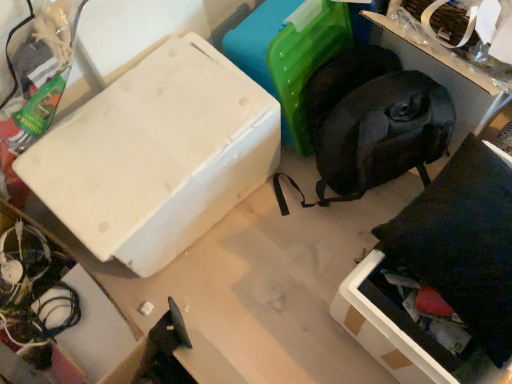
Question: Is the surface of white matte cardboard box at lower left in direct contact with black fabric bag at upper right?

Choices:
 (A) no
 (B) yes

Answer: (A)

Question: Is white matte cardboard box at lower left turned away from black fabric bag at upper right?

Choices:
 (A) yes
 (B) no

Answer: (B)

Question: Does white matte cardboard box at lower left contain black fabric bag at upper right?

Choices:
 (A) no
 (B) yes

Answer: (A)

Question: Is white matte cardboard box at lower left thinner than black fabric bag at upper right?

Choices:
 (A) no
 (B) yes

Answer: (B)

Question: Is white matte cardboard box at lower left shorter than black fabric bag at upper right?

Choices:
 (A) no
 (B) yes

Answer: (B)

Question: Does point (50, 142) appear closer or farther from the camera than point (30, 228)?

Choices:
 (A) farther
 (B) closer

Answer: (B)

Question: Looking at their shapes, would you say white matte box at upper left is wider or thinner than white matte cardboard box at lower left?

Choices:
 (A) thin
 (B) wide

Answer: (A)

Question: Is white matte box at upper left bigger or smaller than white matte cardboard box at lower left?

Choices:
 (A) big
 (B) small

Answer: (B)

Question: In the image, is white matte box at upper left positioned in front of or behind white matte cardboard box at lower left?

Choices:
 (A) front
 (B) behind

Answer: (B)

Question: Considering the relative positions of white matte cardboard box at lower left and white matte box at upper left in the image provided, is white matte cardboard box at lower left to the left or to the right of white matte box at upper left?

Choices:
 (A) right
 (B) left

Answer: (B)

Question: From a real-world perspective, is white matte cardboard box at lower left above or below white matte box at upper left?

Choices:
 (A) below
 (B) above

Answer: (B)

Question: From the image's perspective, is white matte cardboard box at lower left above or below white matte box at upper left?

Choices:
 (A) below
 (B) above

Answer: (A)

Question: Is white matte cardboard box at lower left in front of or behind white matte box at upper left in the image?

Choices:
 (A) behind
 (B) front

Answer: (B)

Question: From the image's perspective, relative to white matte box at upper left, is black fabric bag at upper right above or below?

Choices:
 (A) above
 (B) below

Answer: (A)

Question: Considering the relative positions of black fabric bag at upper right and white matte box at upper left in the image provided, is black fabric bag at upper right to the left or to the right of white matte box at upper left?

Choices:
 (A) left
 (B) right

Answer: (B)